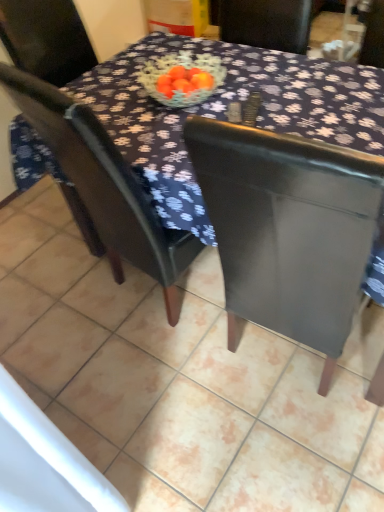
Locate an element on the screen. free point above dark fabric table at center (from a real-world perspective) is located at coordinates click(228, 94).